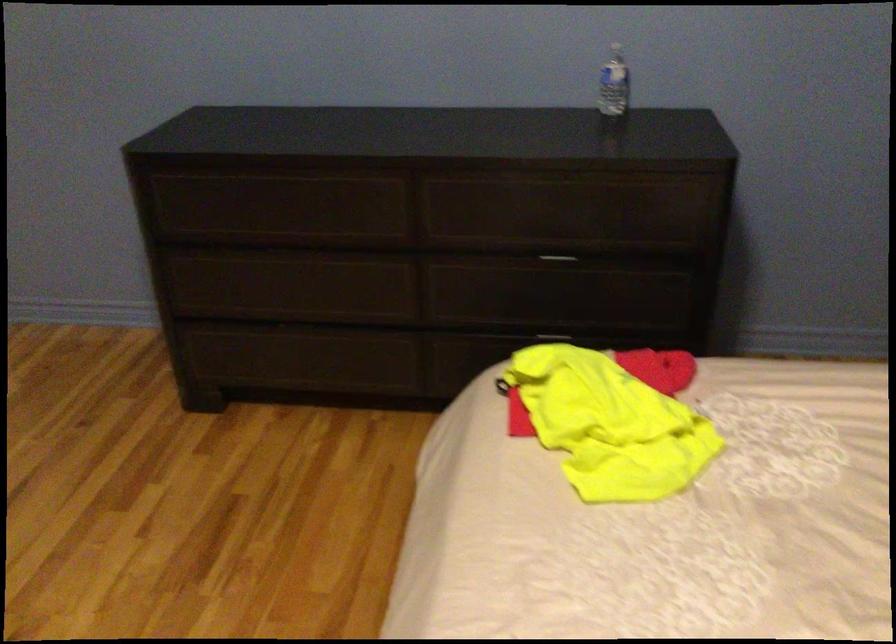
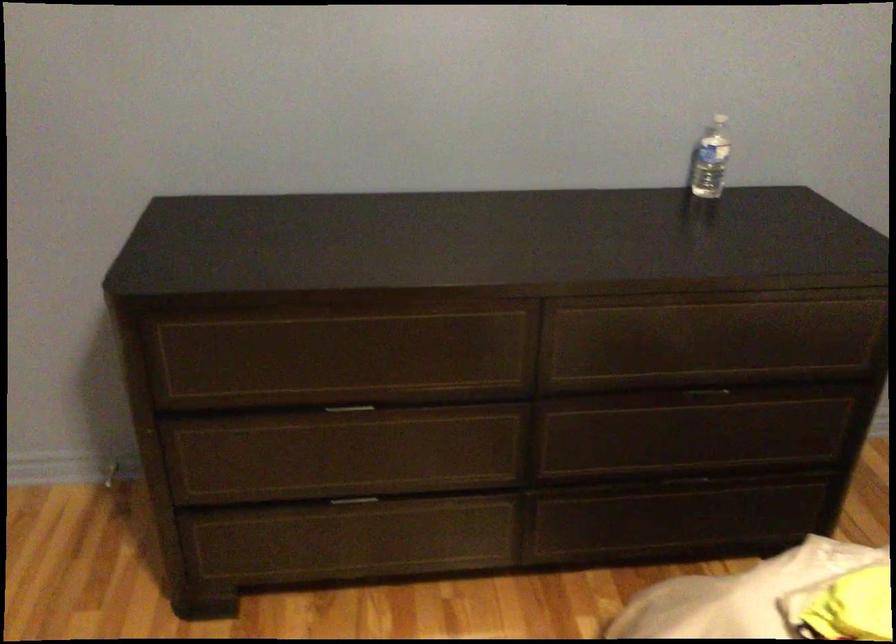
Question: The camera is either moving clockwise (left) or counter-clockwise (right) around the object. The first image is from the beginning of the video and the second image is from the end. Is the camera moving left or right when shooting the video?

Choices:
 (A) Left
 (B) Right

Answer: (A)